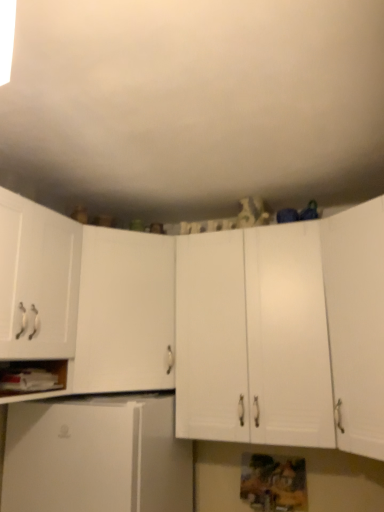
Question: Which direction should I rotate to look at white matte cabinet at center, which is the second cabinetry in right-to-left order, — up or down?

Choices:
 (A) down
 (B) up

Answer: (A)

Question: Is white matte cabinet at right, which appears as the first cabinetry when viewed from the right, beside white matte cabinet at center, which is the second cabinetry in right-to-left order?

Choices:
 (A) no
 (B) yes

Answer: (A)

Question: From a real-world perspective, is white matte cabinet at right, which appears as the first cabinetry when viewed from the right, located higher than white matte cabinet at center, the fourth cabinetry viewed from the left?

Choices:
 (A) no
 (B) yes

Answer: (A)

Question: Does white matte cabinet at right, which appears as the first cabinetry when viewed from the right, have a lesser width compared to white matte cabinet at center, the fourth cabinetry viewed from the left?

Choices:
 (A) yes
 (B) no

Answer: (B)

Question: Can you confirm if white matte cabinet at right, marked as the 5th cabinetry in a left-to-right arrangement, is taller than white matte cabinet at center, which is the second cabinetry in right-to-left order?

Choices:
 (A) yes
 (B) no

Answer: (A)

Question: From the image's perspective, is white matte cabinet at right, marked as the 5th cabinetry in a left-to-right arrangement, above white matte cabinet at center, the fourth cabinetry viewed from the left?

Choices:
 (A) yes
 (B) no

Answer: (A)

Question: Is white matte cabinet at center, which is the second cabinetry in right-to-left order, at the back of white matte cabinet at right, marked as the 5th cabinetry in a left-to-right arrangement?

Choices:
 (A) yes
 (B) no

Answer: (B)

Question: Can you confirm if white matte cabinet at left, placed as the first cabinetry when sorted from left to right, is shorter than white matte cabinet at right, marked as the 5th cabinetry in a left-to-right arrangement?

Choices:
 (A) yes
 (B) no

Answer: (A)

Question: Is white matte cabinet at left, placed as the first cabinetry when sorted from left to right, positioned far away from white matte cabinet at right, which appears as the first cabinetry when viewed from the right?

Choices:
 (A) yes
 (B) no

Answer: (A)

Question: Can you confirm if white matte cabinet at left, which is counted as the fifth cabinetry, starting from the right, is thinner than white matte cabinet at right, which appears as the first cabinetry when viewed from the right?

Choices:
 (A) no
 (B) yes

Answer: (B)

Question: From a real-world perspective, does white matte cabinet at left, which is counted as the fifth cabinetry, starting from the right, stand above white matte cabinet at right, which appears as the first cabinetry when viewed from the right?

Choices:
 (A) yes
 (B) no

Answer: (A)

Question: Can white matte cabinet at right, which appears as the first cabinetry when viewed from the right, be found inside white matte cabinet at left, which is counted as the fifth cabinetry, starting from the right?

Choices:
 (A) no
 (B) yes

Answer: (A)

Question: Is white matte cabinet at left, placed as the first cabinetry when sorted from left to right, smaller than white matte cabinet at right, which appears as the first cabinetry when viewed from the right?

Choices:
 (A) yes
 (B) no

Answer: (A)

Question: Is white matte cabinet at lower left positioned far away from white matte cabinet at left, which ranks as the 3th cabinetry in right-to-left order?

Choices:
 (A) no
 (B) yes

Answer: (A)